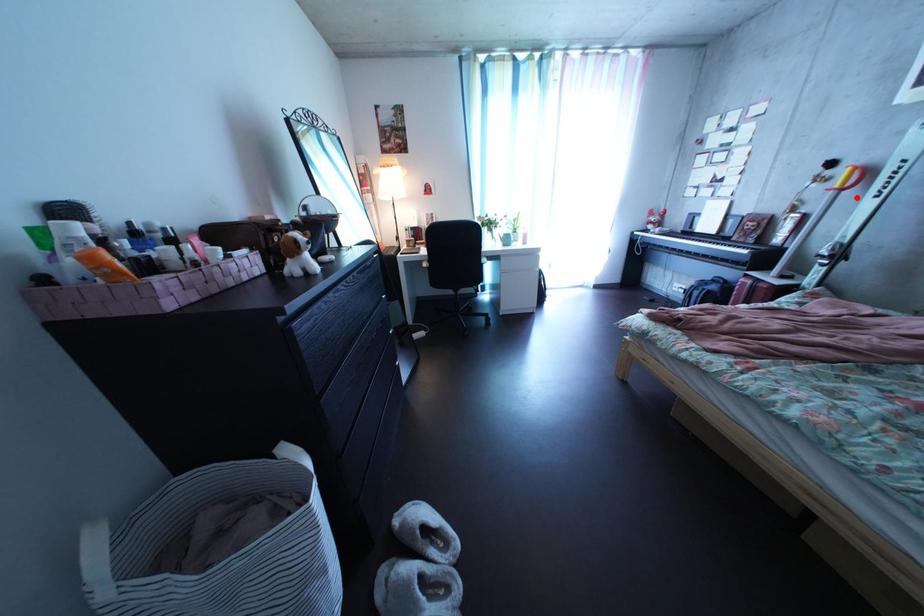
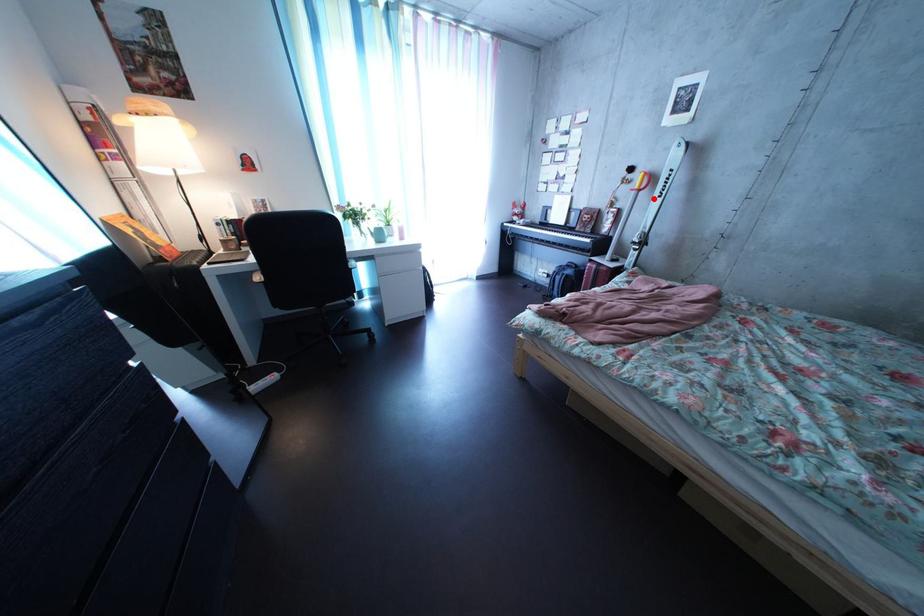
I am providing you with two images of the same scene from different viewpoints. A red point is marked on the first image and another point is marked on the second image. Do the highlighted points in image1 and image2 indicate the same real-world spot?

Yes